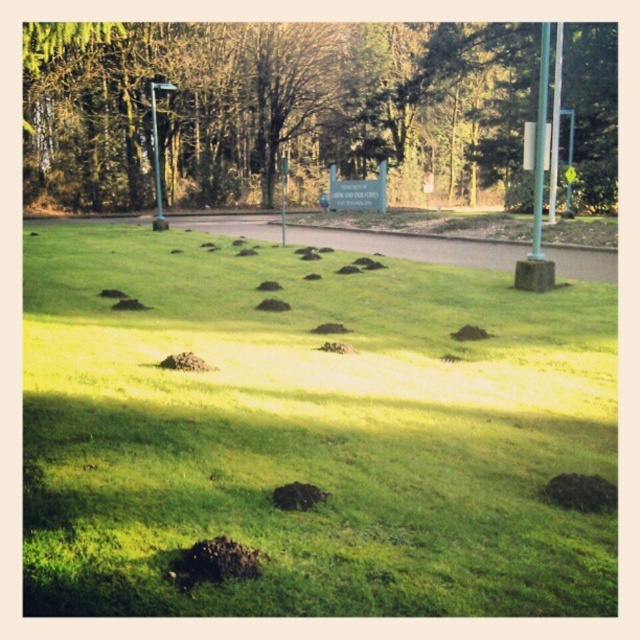
Does dark brown dirt mounds at center appear on the right side of green leafy tree at center?

Correct, you'll find dark brown dirt mounds at center to the right of green leafy tree at center.

Which is in front, point (289, 349) or point (256, 122)?

Point (289, 349) is more forward.

Is point (64, 406) in front of point (225, 134)?

Yes, it is in front of point (225, 134).

Identify the location of dark brown dirt mounds at center. (308, 432).